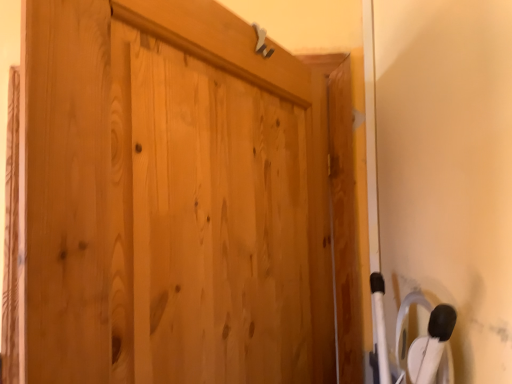
What do you see at coordinates (170, 192) in the screenshot? I see `natural wood door at center` at bounding box center [170, 192].

In the scene shown: Measure the distance between point (128, 78) and camera.

A distance of 22.36 inches exists between point (128, 78) and camera.

Identify the location of natural wood door at center. This screenshot has height=384, width=512. (170, 192).

Identify the location of natural wood door at center. Image resolution: width=512 pixels, height=384 pixels. (170, 192).